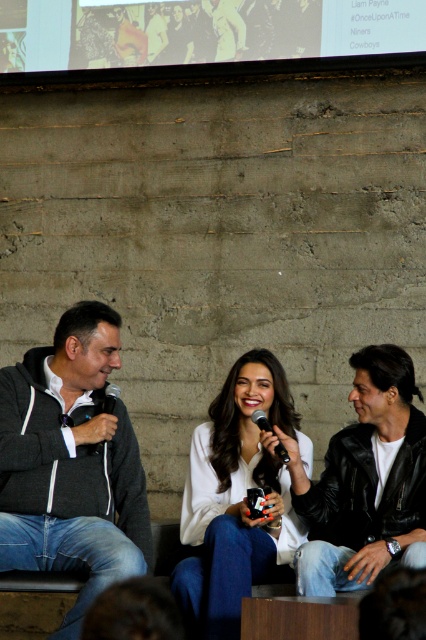
Question: Is dark gray hoodie at left to the right of black leather jacket at center from the viewer's perspective?

Choices:
 (A) yes
 (B) no

Answer: (B)

Question: Considering the relative positions of black leather jacket at center and black matte microphone at center in the image provided, where is black leather jacket at center located with respect to black matte microphone at center?

Choices:
 (A) below
 (B) above

Answer: (A)

Question: Based on their relative distances, which object is nearer to the metallic silver microphone at center?

Choices:
 (A) black matte microphone at center
 (B) black leather jacket at center
 (C) white matte shirt at center

Answer: (C)

Question: Which object is positioned closest to the metallic silver microphone at center?

Choices:
 (A) black leather jacket at center
 (B) dark gray hoodie at left
 (C) white matte shirt at center
 (D) black matte microphone at center

Answer: (C)

Question: Can you confirm if black matte microphone at center is thinner than metallic silver microphone at center?

Choices:
 (A) yes
 (B) no

Answer: (A)

Question: Estimate the real-world distances between objects in this image. Which object is closer to the black leather jacket at center?

Choices:
 (A) dark gray hoodie at left
 (B) white matte shirt at center

Answer: (B)